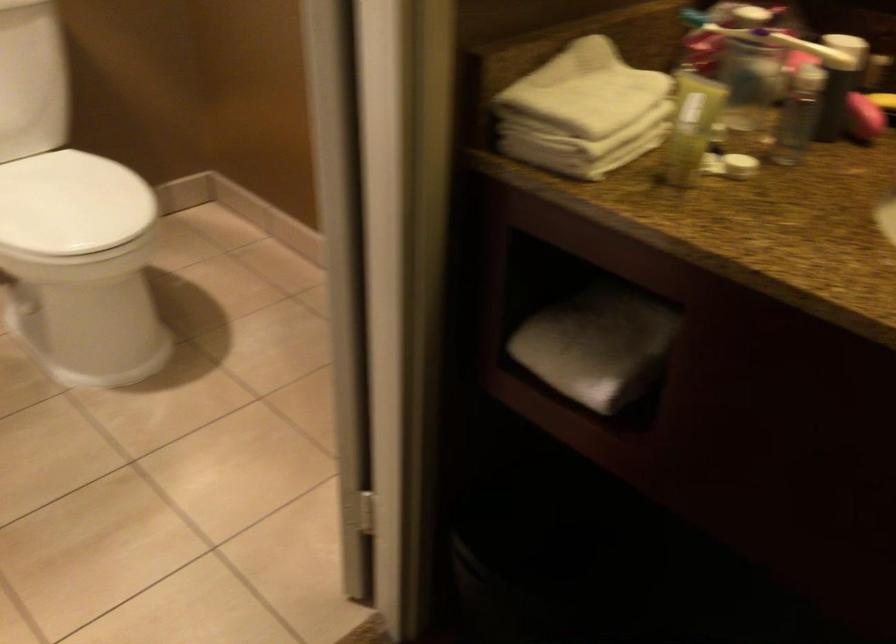
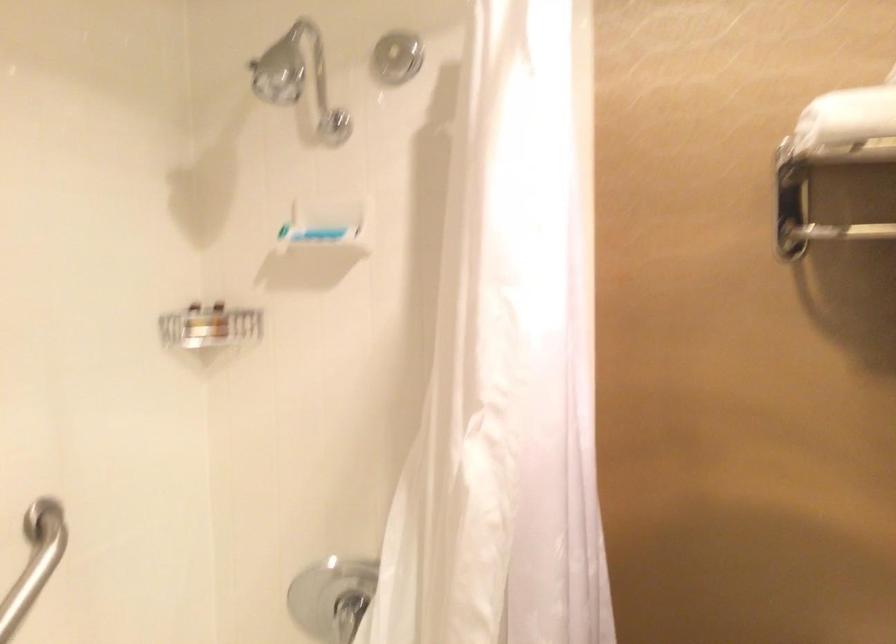
Question: The images are taken continuously from a first-person perspective. In which direction is your viewpoint rotating?

Choices:
 (A) Left
 (B) Right
 (C) Up
 (D) Down

Answer: (A)